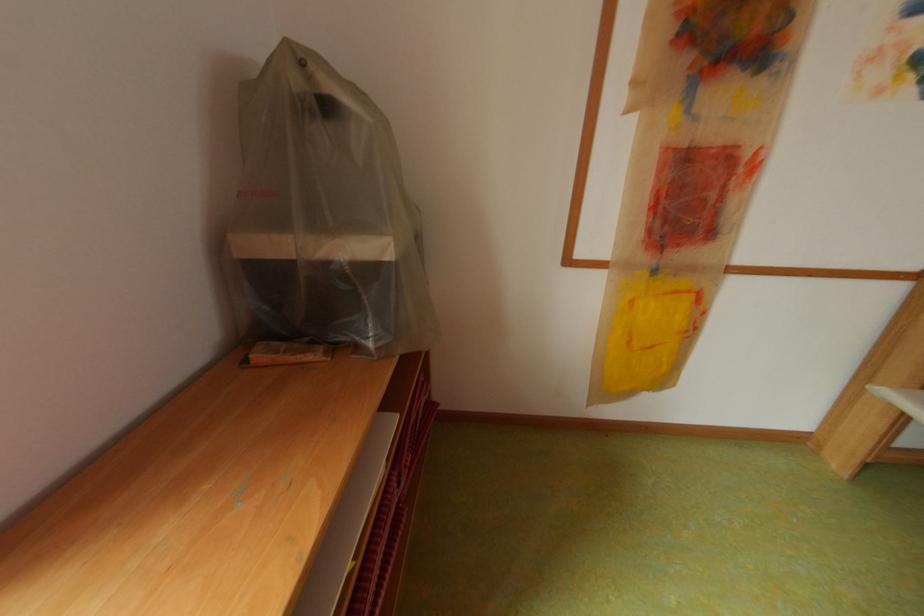
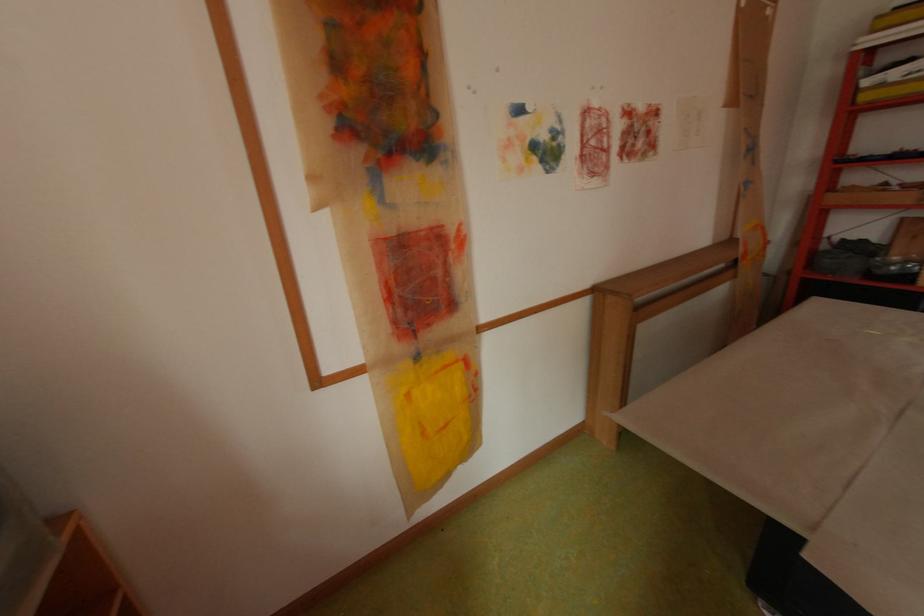
Find the pixel in the second image that matches pixel 664 272 in the first image.

(429, 358)